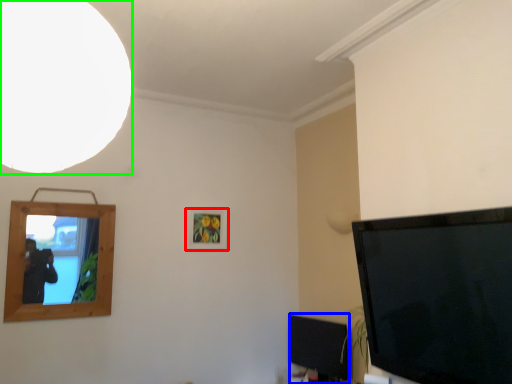
Question: Which object is the closest to the picture frame (highlighted by a red box)? Choose among these: television (highlighted by a blue box) or light (highlighted by a green box).

Choices:
 (A) television
 (B) light

Answer: (A)